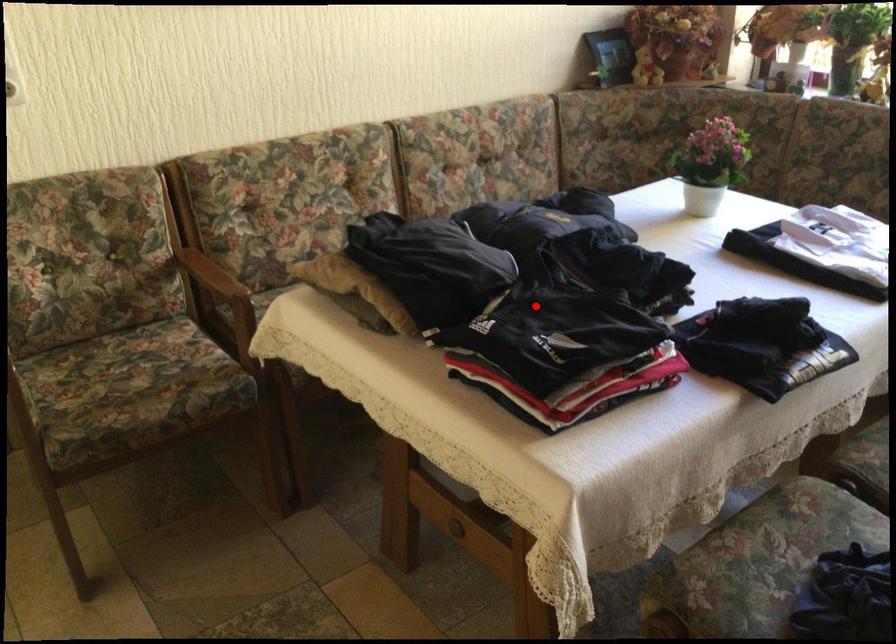
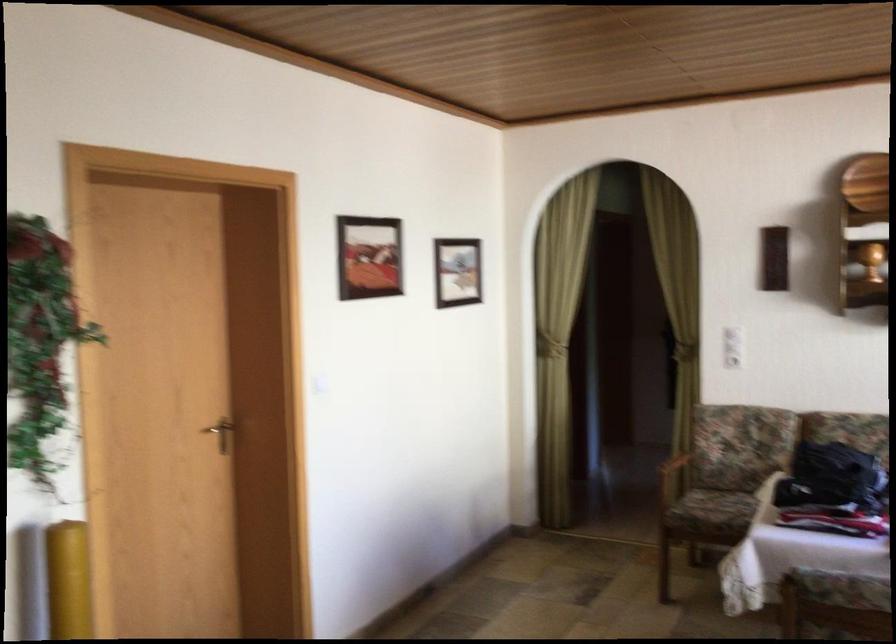
Question: I am providing you with two images of the same scene from different viewpoints. In image1, a red point is highlighted. Considering the same 3D point in image2, which of the following is correct?

Choices:
 (A) It is closer
 (B) It is farther

Answer: (B)